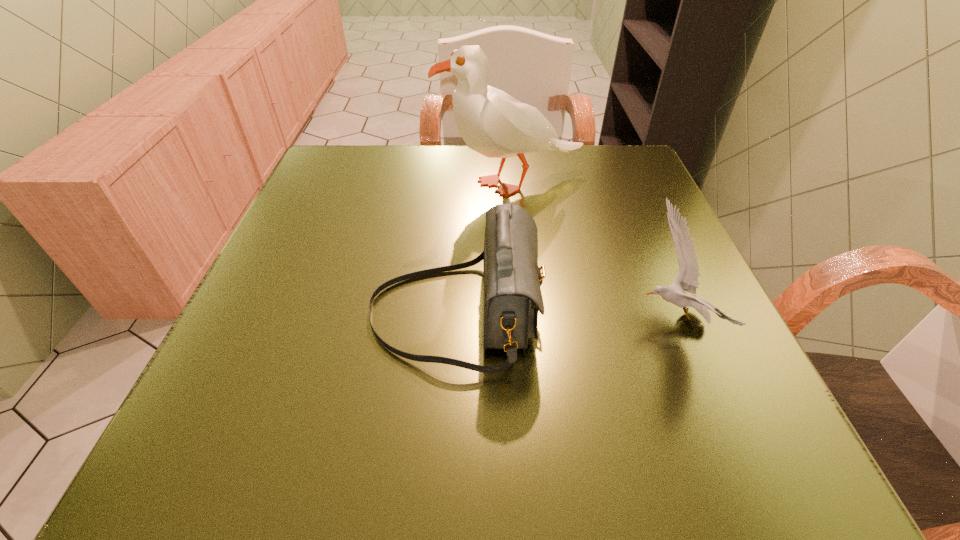
Where is `free location located 0.050m at the tip of the beak of the shortest object`? free location located 0.050m at the tip of the beak of the shortest object is located at coordinates (607, 318).

This screenshot has height=540, width=960. What are the coordinates of `free space located at the tip of the beak of the shortest object` in the screenshot? It's located at (444, 318).

Locate an element on the screen. Image resolution: width=960 pixels, height=540 pixels. object located at the far edge is located at coordinates (491, 122).

Where is `object that is at the far right corner`? The image size is (960, 540). object that is at the far right corner is located at coordinates (491, 122).

I want to click on vacant point at the far edge, so click(474, 199).

Image resolution: width=960 pixels, height=540 pixels. In order to click on vacant space at the near edge of the desktop in this screenshot , I will do `click(574, 460)`.

The width and height of the screenshot is (960, 540). In order to click on vacant space at the left edge of the desktop in this screenshot , I will do `click(343, 233)`.

This screenshot has width=960, height=540. What are the coordinates of `vacant region at the right edge of the desktop` in the screenshot? It's located at (707, 295).

Locate an element on the screen. vacant region at the far left corner of the desktop is located at coordinates (328, 200).

Identify the location of vacant area at the near left corner. (243, 460).